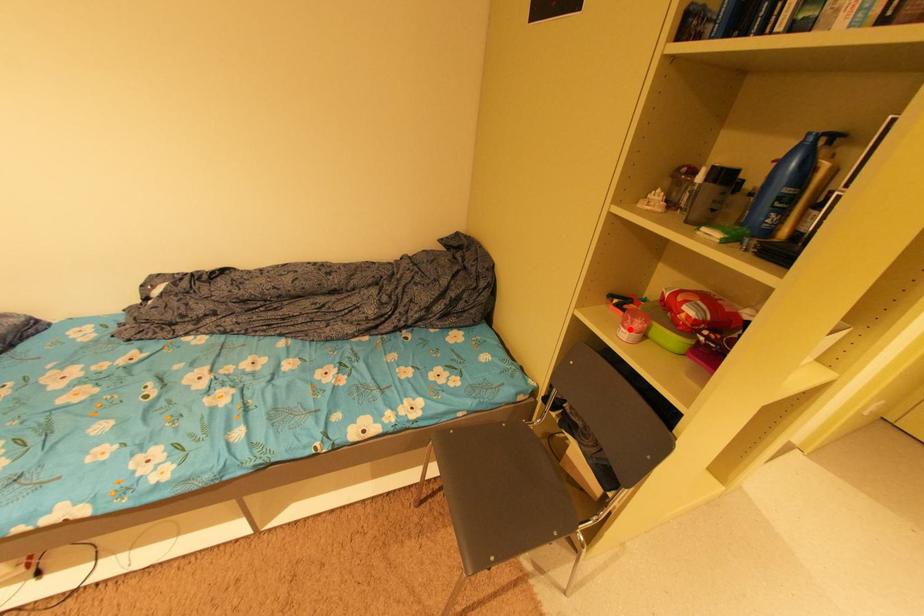
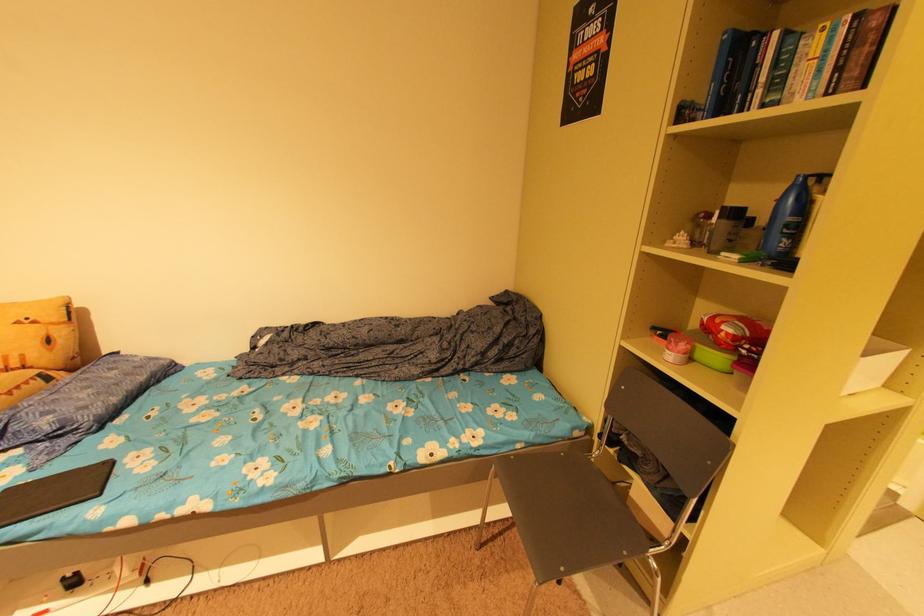
In the second image, find the point that corresponds to the highlighted location in the first image.

(675, 353)